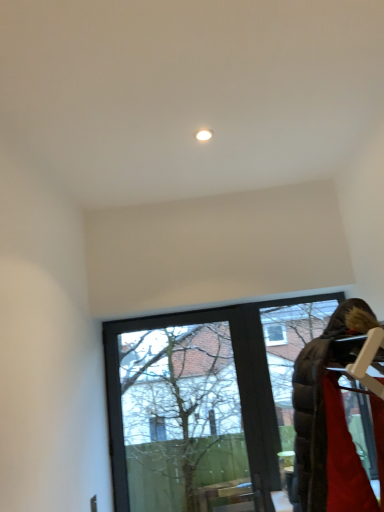
Question: Considering the relative sizes of transparent glass window at center and velvet brown coat at lower right in the image provided, is transparent glass window at center taller than velvet brown coat at lower right?

Choices:
 (A) yes
 (B) no

Answer: (A)

Question: Is transparent glass window at center oriented towards velvet brown coat at lower right?

Choices:
 (A) no
 (B) yes

Answer: (B)

Question: Does transparent glass window at center have a lesser height compared to velvet brown coat at lower right?

Choices:
 (A) no
 (B) yes

Answer: (A)

Question: Does transparent glass window at center have a smaller size compared to velvet brown coat at lower right?

Choices:
 (A) no
 (B) yes

Answer: (A)

Question: Considering the relative positions of transparent glass window at center and velvet brown coat at lower right in the image provided, is transparent glass window at center in front of velvet brown coat at lower right?

Choices:
 (A) yes
 (B) no

Answer: (B)

Question: Is transparent glass window at center oriented away from velvet brown coat at lower right?

Choices:
 (A) no
 (B) yes

Answer: (A)

Question: Is velvet brown coat at lower right oriented away from transparent glass window at center?

Choices:
 (A) no
 (B) yes

Answer: (A)

Question: Can you confirm if velvet brown coat at lower right is wider than transparent glass window at center?

Choices:
 (A) no
 (B) yes

Answer: (B)

Question: Is velvet brown coat at lower right located outside transparent glass window at center?

Choices:
 (A) yes
 (B) no

Answer: (A)

Question: Does velvet brown coat at lower right appear on the right side of transparent glass window at center?

Choices:
 (A) no
 (B) yes

Answer: (B)

Question: Considering the relative positions of velvet brown coat at lower right and transparent glass window at center in the image provided, is velvet brown coat at lower right behind transparent glass window at center?

Choices:
 (A) no
 (B) yes

Answer: (A)

Question: From the image's perspective, is velvet brown coat at lower right located beneath transparent glass window at center?

Choices:
 (A) yes
 (B) no

Answer: (B)

Question: Is velvet brown coat at lower right inside the boundaries of transparent glass window at center, or outside?

Choices:
 (A) inside
 (B) outside

Answer: (B)